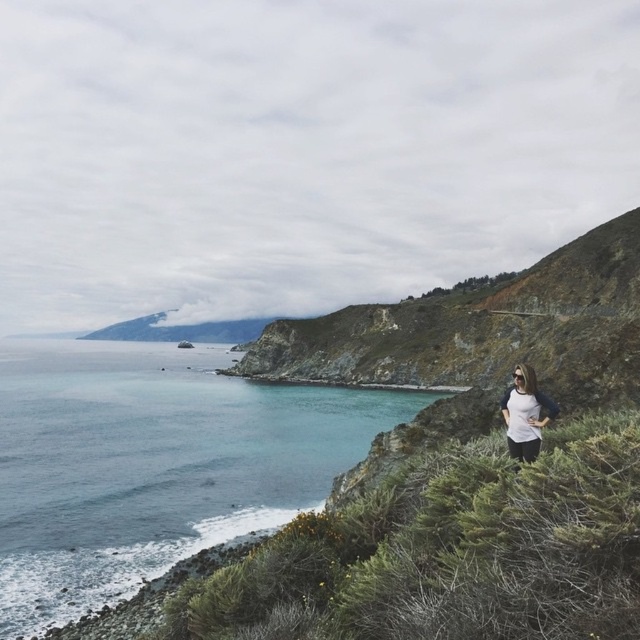
Question: Does blue water at lower left have a greater width compared to rocky cliff at center?

Choices:
 (A) yes
 (B) no

Answer: (A)

Question: Can you confirm if blue water at lower left is positioned to the left of white matte shirt at center?

Choices:
 (A) no
 (B) yes

Answer: (B)

Question: Where is blue water at lower left located in relation to rocky cliff at center in the image?

Choices:
 (A) left
 (B) right

Answer: (A)

Question: Which of the following is the farthest from the observer?

Choices:
 (A) (296, 353)
 (B) (513, 396)

Answer: (A)

Question: Which of these objects is positioned closest to the white matte shirt at center?

Choices:
 (A) rocky cliff at center
 (B) blue water at lower left

Answer: (A)

Question: Which object appears farthest from the camera in this image?

Choices:
 (A) blue water at lower left
 (B) white matte shirt at center

Answer: (A)